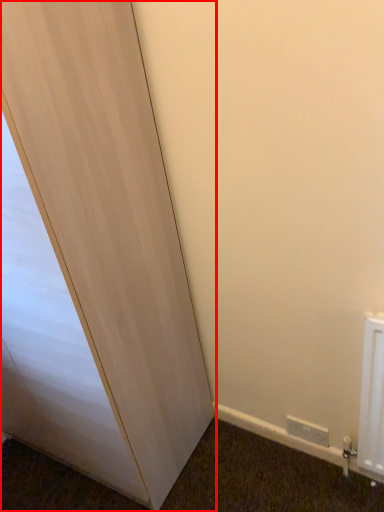
Question: From the image, what is the correct spatial relationship of door (annotated by the red box) in relation to electric outlet?

Choices:
 (A) right
 (B) left

Answer: (B)